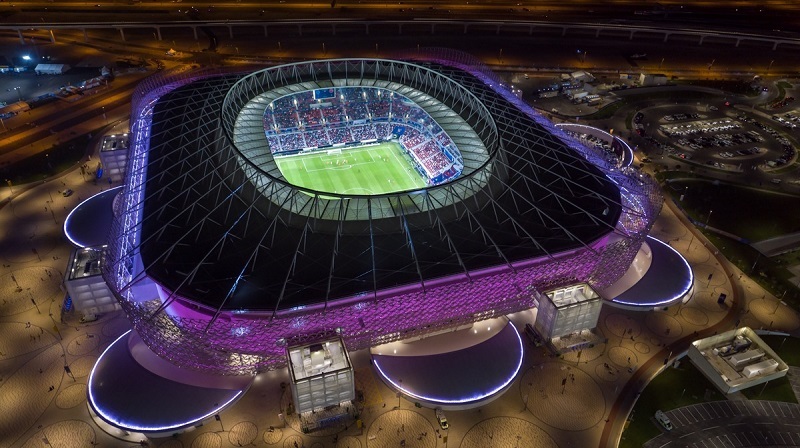
In order to click on cover in this screenshot , I will do `click(132, 387)`.